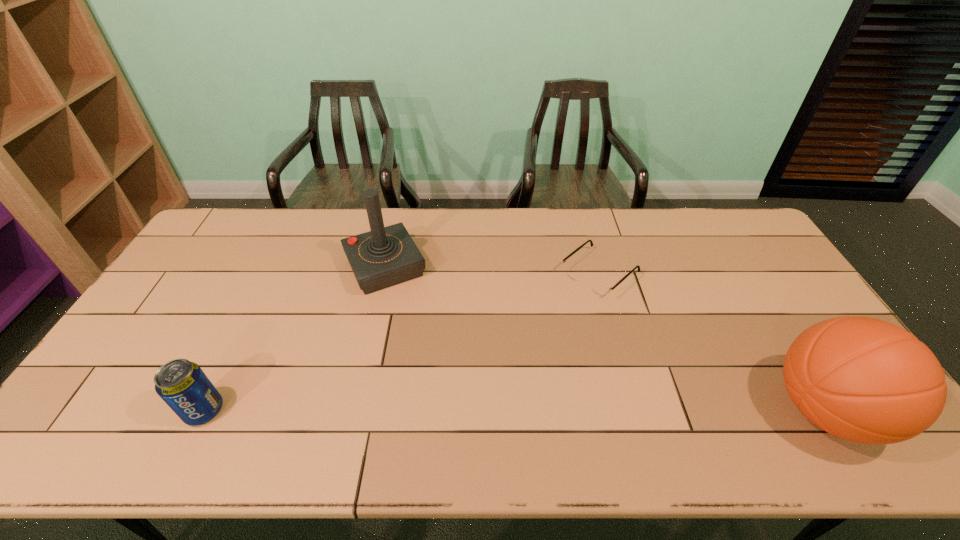
Where is `vacant area that lies between the basketball and the joystick`? The width and height of the screenshot is (960, 540). vacant area that lies between the basketball and the joystick is located at coordinates (606, 339).

Identify the location of vacant area between the joystick and the basketball. (606, 339).

This screenshot has width=960, height=540. What are the coordinates of `unoccupied position between the third object from right to left and the leftmost object` in the screenshot? It's located at (295, 339).

I want to click on vacant space that's between the shortest object and the third tallest object, so click(401, 342).

I want to click on vacant area between the basketball and the joystick, so click(x=606, y=339).

This screenshot has width=960, height=540. In order to click on object that ranks as the second closest to the shortest object in this screenshot , I will do `click(385, 256)`.

What are the coordinates of `object that is the second closest to the soda` in the screenshot? It's located at (597, 287).

Where is `vacant space that satisfies the following two spatial constraints: 1. on the front side of the second object from left to right; 2. on the right side of the shortest object`? This screenshot has width=960, height=540. vacant space that satisfies the following two spatial constraints: 1. on the front side of the second object from left to right; 2. on the right side of the shortest object is located at coordinates (384, 274).